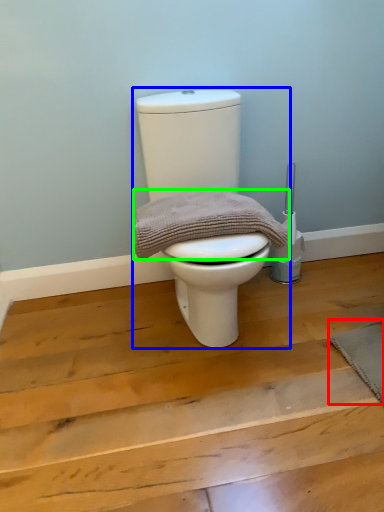
Question: Estimate the real-world distances between objects in this image. Which object is farther from doormat (highlighted by a red box), toilet (highlighted by a blue box) or material (highlighted by a green box)?

Choices:
 (A) toilet
 (B) material

Answer: (A)